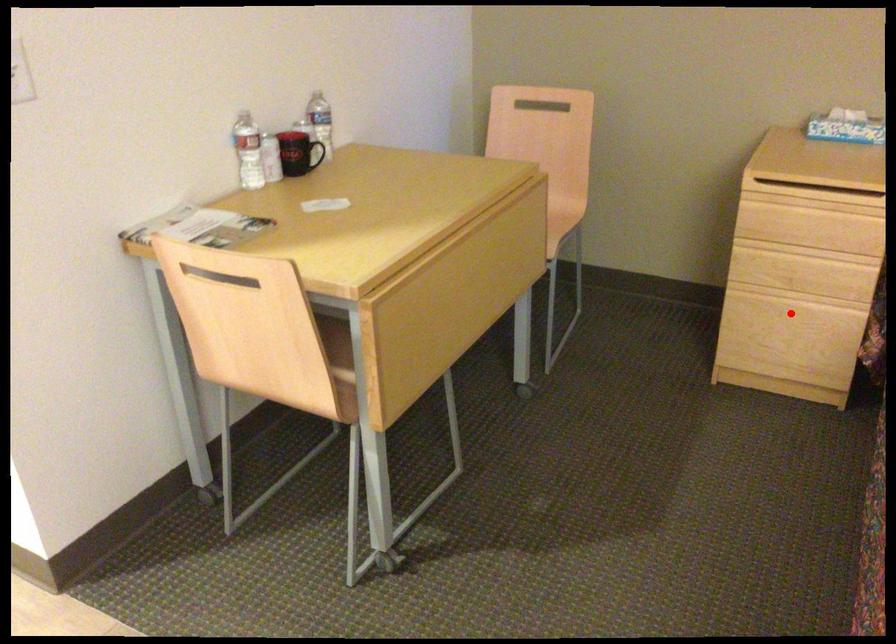
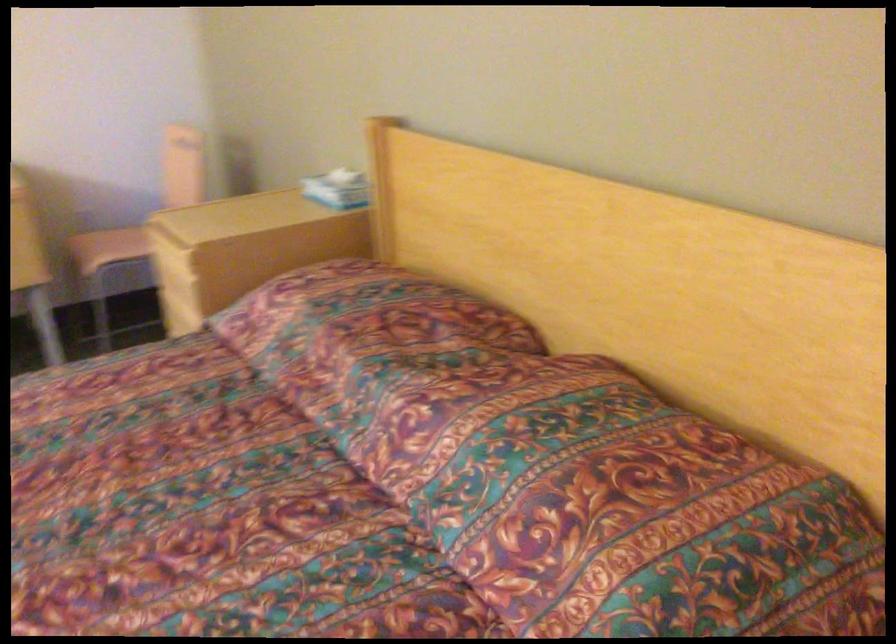
Question: I am providing you with two images of the same scene from different viewpoints. A red point is marked on the first image. Is the red point's position out of view in image 2?

Choices:
 (A) Yes
 (B) No

Answer: (A)